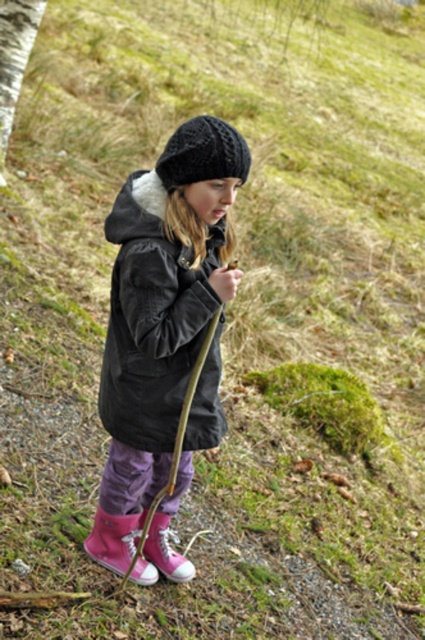
Is point (149, 216) closer to camera compared to point (167, 544)?

Yes, point (149, 216) is closer to viewer.

You are a GUI agent. You are given a task and a screenshot of the screen. Output one action in this format:
    pyautogui.click(x=<x>, y=<y>)
    Task: Click on the matte black jacket at center
    
    Given the screenshot: What is the action you would take?
    pyautogui.click(x=152, y=316)

Is pink suede boot at lower left taller than pink suede boot at lower center?

Correct, pink suede boot at lower left is much taller as pink suede boot at lower center.

Between point (99, 528) and point (144, 515), which one is positioned in front?

Point (99, 528) is more forward.

Identify the location of pink suede boot at lower left. This screenshot has height=640, width=425. (119, 547).

Which is below, black knitted hat at upper center or bark-like textured tree trunk at left?

black knitted hat at upper center is lower down.

Who is more distant from viewer, (244, 168) or (3, 19)?

The point (3, 19) is more distant.

The height and width of the screenshot is (640, 425). Describe the element at coordinates (203, 154) in the screenshot. I see `black knitted hat at upper center` at that location.

Where is `black knitted hat at upper center`? This screenshot has width=425, height=640. black knitted hat at upper center is located at coordinates (203, 154).